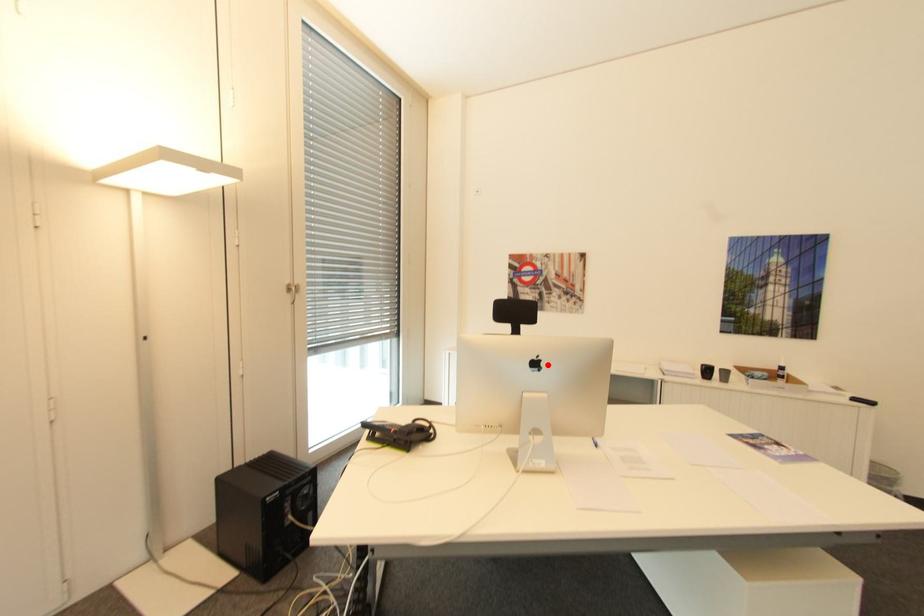
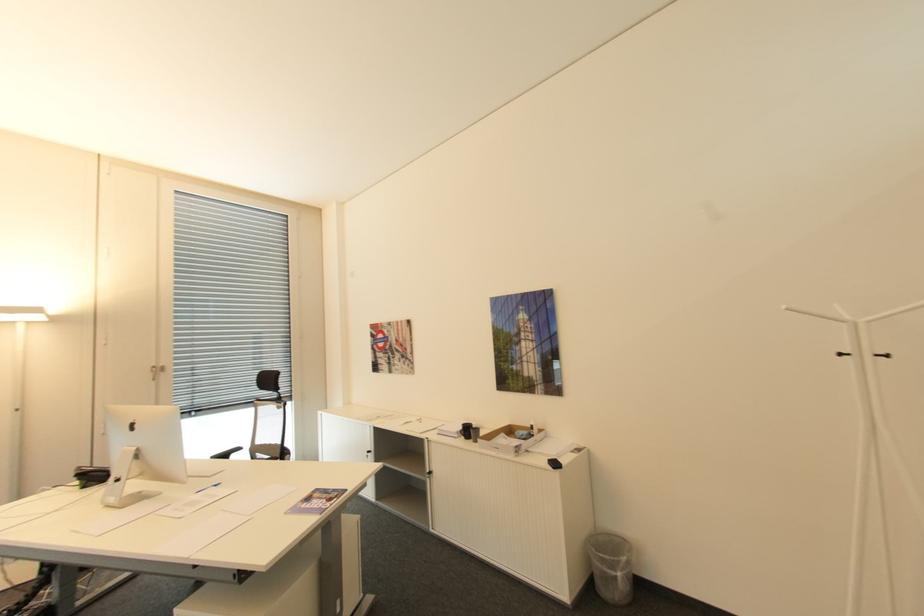
Question: I am providing you with two images of the same scene from different viewpoints. In image1, a red point is highlighted. Considering the same 3D point in image2, which of the following is correct?

Choices:
 (A) It is closer
 (B) It is farther

Answer: (A)